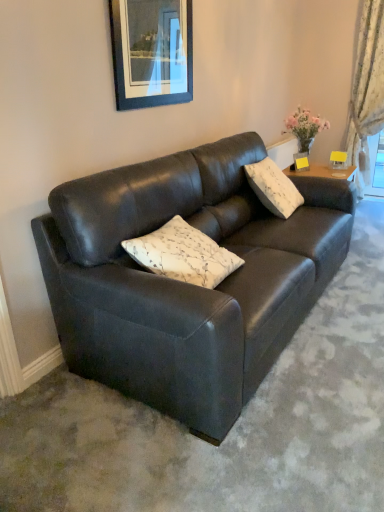
The width and height of the screenshot is (384, 512). What do you see at coordinates (366, 87) in the screenshot?
I see `white floral fabric curtain at right` at bounding box center [366, 87].

What do you see at coordinates (273, 188) in the screenshot? The image size is (384, 512). I see `white textured pillow at upper right, the 2th pillow positioned from the bottom` at bounding box center [273, 188].

What do you see at coordinates (183, 254) in the screenshot?
I see `white floral-patterned cushion at center, the 1th pillow positioned from the left` at bounding box center [183, 254].

Where is `matte black couch at center`? This screenshot has height=512, width=384. matte black couch at center is located at coordinates (184, 283).

Image resolution: width=384 pixels, height=512 pixels. Identify the location of white floral fabric curtain at right. (366, 87).

Between white floral fabric curtain at right and white textured pillow at upper right, which is counted as the second pillow, starting from the front, which one is positioned in front?

white textured pillow at upper right, which is counted as the second pillow, starting from the front, is closer to the camera.

From a real-world perspective, which object stands above the other?

white floral fabric curtain at right, from a real-world perspective.

Would you say white textured pillow at upper right, the first pillow viewed from the back, is part of white floral fabric curtain at right's contents?

That's incorrect, white textured pillow at upper right, the first pillow viewed from the back, is not inside white floral fabric curtain at right.

Is white floral fabric curtain at right to the right of white textured pillow at upper right, the 2th pillow positioned from the bottom, from the viewer's perspective?

Indeed, white floral fabric curtain at right is positioned on the right side of white textured pillow at upper right, the 2th pillow positioned from the bottom.

Can you confirm if matte black couch at center is bigger than white floral fabric curtain at right?

Indeed, matte black couch at center has a larger size compared to white floral fabric curtain at right.

Is matte black couch at center to the left or to the right of white floral fabric curtain at right in the image?

From the image, it's evident that matte black couch at center is to the left of white floral fabric curtain at right.

Can white floral fabric curtain at right be found inside matte black couch at center?

Definitely not — white floral fabric curtain at right is not inside matte black couch at center.

From a real-world perspective, does matte black couch at center stand above white floral fabric curtain at right?

No, from a real-world perspective, matte black couch at center is not on top of white floral fabric curtain at right.

Can you tell me how much white textured pillow at upper right, which is the 1th pillow from right to left, and white floral-patterned cushion at center, positioned as the 1th pillow in bottom-to-top order, differ in facing direction?

0.452 degrees separate the facing orientations of white textured pillow at upper right, which is the 1th pillow from right to left, and white floral-patterned cushion at center, positioned as the 1th pillow in bottom-to-top order.

Is white textured pillow at upper right, the first pillow viewed from the back, wider or thinner than white floral-patterned cushion at center, positioned as the second pillow in back-to-front order?

Clearly, white textured pillow at upper right, the first pillow viewed from the back, has more width compared to white floral-patterned cushion at center, positioned as the second pillow in back-to-front order.

Considering the positions of objects white textured pillow at upper right, the first pillow viewed from the back, and white floral-patterned cushion at center, placed as the second pillow when sorted from top to bottom, in the image provided, who is behind, white textured pillow at upper right, the first pillow viewed from the back, or white floral-patterned cushion at center, placed as the second pillow when sorted from top to bottom,?

white textured pillow at upper right, the first pillow viewed from the back, is more distant.

Is white floral-patterned cushion at center, positioned as the 1th pillow in bottom-to-top order, to the left or to the right of white floral fabric curtain at right in the image?

white floral-patterned cushion at center, positioned as the 1th pillow in bottom-to-top order, is to the left of white floral fabric curtain at right.

From a real-world perspective, does white floral-patterned cushion at center, positioned as the 1th pillow in bottom-to-top order, sit lower than white floral fabric curtain at right?

Yes, from a real-world perspective, white floral-patterned cushion at center, positioned as the 1th pillow in bottom-to-top order, is beneath white floral fabric curtain at right.

Consider the image. Could white floral fabric curtain at right be considered to be inside white floral-patterned cushion at center, positioned as the 1th pillow in bottom-to-top order?

No, white floral fabric curtain at right is not inside white floral-patterned cushion at center, positioned as the 1th pillow in bottom-to-top order.

Measure the distance between white floral-patterned cushion at center, positioned as the 1th pillow in bottom-to-top order, and white floral fabric curtain at right.

A distance of 10.27 feet exists between white floral-patterned cushion at center, positioned as the 1th pillow in bottom-to-top order, and white floral fabric curtain at right.

Is matte black picture frame at upper center to the right of matte black couch at center from the viewer's perspective?

In fact, matte black picture frame at upper center is to the left of matte black couch at center.

From a real-world perspective, which is physically below, matte black picture frame at upper center or matte black couch at center?

matte black couch at center.

Is matte black picture frame at upper center next to matte black couch at center and touching it?

No, matte black picture frame at upper center is not making contact with matte black couch at center.

Considering the sizes of objects white textured pillow at upper right, which is counted as the second pillow, starting from the front, and matte black couch at center in the image provided, who is shorter, white textured pillow at upper right, which is counted as the second pillow, starting from the front, or matte black couch at center?

white textured pillow at upper right, which is counted as the second pillow, starting from the front, is shorter.

Identify the location of pillow on the right side of matte black couch at center. The height and width of the screenshot is (512, 384). (273, 188).

Based on the photo, considering the relative positions of white textured pillow at upper right, which is the second pillow from left to right, and matte black couch at center in the image provided, is white textured pillow at upper right, which is the second pillow from left to right, to the right of matte black couch at center from the viewer's perspective?

Yes, white textured pillow at upper right, which is the second pillow from left to right, is to the right of matte black couch at center.

Is white textured pillow at upper right, which is counted as the second pillow, starting from the front, further to the viewer compared to matte black couch at center?

Yes, the depth of white textured pillow at upper right, which is counted as the second pillow, starting from the front, is greater than that of matte black couch at center.

Considering the relative positions of white textured pillow at upper right, the 2th pillow positioned from the bottom, and matte black picture frame at upper center in the image provided, is white textured pillow at upper right, the 2th pillow positioned from the bottom, to the right of matte black picture frame at upper center from the viewer's perspective?

Indeed, white textured pillow at upper right, the 2th pillow positioned from the bottom, is positioned on the right side of matte black picture frame at upper center.

Would you consider white textured pillow at upper right, the 2th pillow positioned from the bottom, to be distant from matte black picture frame at upper center?

That's not correct — white textured pillow at upper right, the 2th pillow positioned from the bottom, is a little close to matte black picture frame at upper center.

Image resolution: width=384 pixels, height=512 pixels. What are the coordinates of `picture frame that appears in front of the white textured pillow at upper right, which is the 1th pillow from top to bottom` in the screenshot? It's located at (152, 52).

Consider the image. Which object is closer to the camera taking this photo, white textured pillow at upper right, which is the second pillow from left to right, or matte black picture frame at upper center?

matte black picture frame at upper center.

Identify the location of curtain located above the white textured pillow at upper right, which is counted as the second pillow, starting from the front (from a real-world perspective). (366, 87).

The image size is (384, 512). What are the coordinates of `studio couch in front of the white floral fabric curtain at right` in the screenshot? It's located at (x=184, y=283).

Considering their positions, is white textured pillow at upper right, which is the 1th pillow from right to left, positioned closer to white floral-patterned cushion at center, placed as the second pillow when sorted from top to bottom, than matte black couch at center?

matte black couch at center lies closer to white floral-patterned cushion at center, placed as the second pillow when sorted from top to bottom, than the other object.

In the scene shown: Based on their spatial positions, is matte black picture frame at upper center or white textured pillow at upper right, which is the 1th pillow from right to left, further from white floral fabric curtain at right?

The object further to white floral fabric curtain at right is matte black picture frame at upper center.

Based on their spatial positions, is matte black picture frame at upper center or white textured pillow at upper right, which is counted as the second pillow, starting from the front, closer to white floral-patterned cushion at center, the second pillow when ordered from right to left?

matte black picture frame at upper center is positioned closer to the anchor white floral-patterned cushion at center, the second pillow when ordered from right to left.

Looking at the image, which one is located further to white floral fabric curtain at right, matte black picture frame at upper center or white floral-patterned cushion at center, the first pillow in the front-to-back sequence?

Among the two, white floral-patterned cushion at center, the first pillow in the front-to-back sequence, is located further to white floral fabric curtain at right.

From the image, which object appears to be farther from white textured pillow at upper right, which is the 1th pillow from top to bottom, white floral-patterned cushion at center, the 1th pillow positioned from the left, or matte black picture frame at upper center?

Based on the image, white floral-patterned cushion at center, the 1th pillow positioned from the left, appears to be further to white textured pillow at upper right, which is the 1th pillow from top to bottom.

Estimate the real-world distances between objects in this image. Which object is closer to white floral-patterned cushion at center, the 1th pillow positioned from the left, white textured pillow at upper right, which is the second pillow from left to right, or matte black picture frame at upper center?

matte black picture frame at upper center is positioned closer to the anchor white floral-patterned cushion at center, the 1th pillow positioned from the left.

Which object lies further to the anchor point white floral-patterned cushion at center, the 1th pillow positioned from the left, matte black couch at center or white textured pillow at upper right, which is the 1th pillow from right to left?

white textured pillow at upper right, which is the 1th pillow from right to left, is positioned further to the anchor white floral-patterned cushion at center, the 1th pillow positioned from the left.

Estimate the real-world distances between objects in this image. Which object is further from white floral-patterned cushion at center, the second pillow when ordered from right to left, matte black picture frame at upper center or matte black couch at center?

Among the two, matte black picture frame at upper center is located further to white floral-patterned cushion at center, the second pillow when ordered from right to left.

I want to click on picture frame between matte black couch at center and white textured pillow at upper right, which is the second pillow from left to right, along the z-axis, so click(x=152, y=52).

Find the location of a particular element. picture frame between matte black couch at center and white floral fabric curtain at right from front to back is located at coordinates (152, 52).

I want to click on pillow between matte black couch at center and white textured pillow at upper right, which is the second pillow from left to right, in the front-back direction, so click(x=183, y=254).

Image resolution: width=384 pixels, height=512 pixels. In order to click on pillow between white floral-patterned cushion at center, the first pillow in the front-to-back sequence, and white floral fabric curtain at right from front to back in this screenshot , I will do `click(273, 188)`.